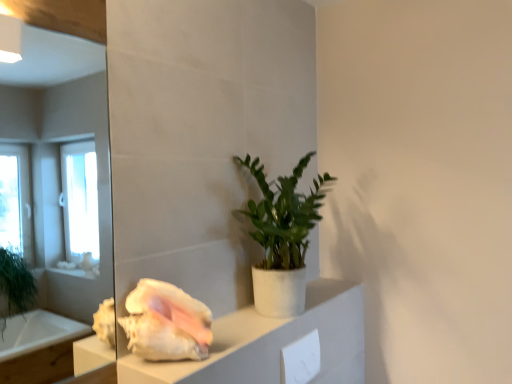
Question: Considering their positions, is green matte plant at center located in front of or behind white matte cabinet at center?

Choices:
 (A) behind
 (B) front

Answer: (A)

Question: From the image's perspective, is green matte plant at center located above or below white matte cabinet at center?

Choices:
 (A) above
 (B) below

Answer: (A)

Question: Estimate the real-world distances between objects in this image. Which object is farther from the green matte plant at center?

Choices:
 (A) white glossy seashell at lower left
 (B) white matte cabinet at center

Answer: (A)

Question: Which of these objects is positioned closest to the white glossy seashell at lower left?

Choices:
 (A) white matte cabinet at center
 (B) green matte plant at center

Answer: (A)